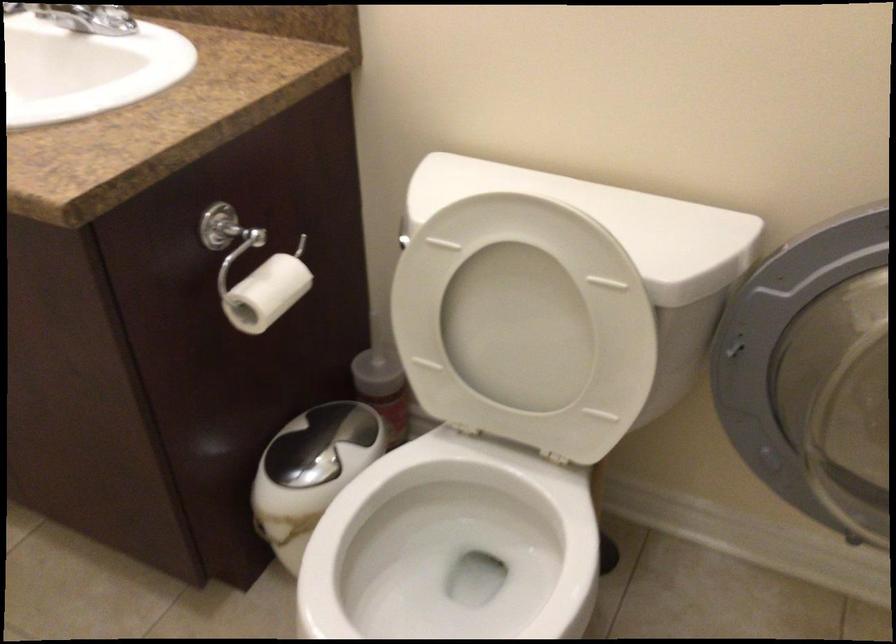
This screenshot has height=644, width=896. I want to click on faucet handle, so click(x=89, y=19).